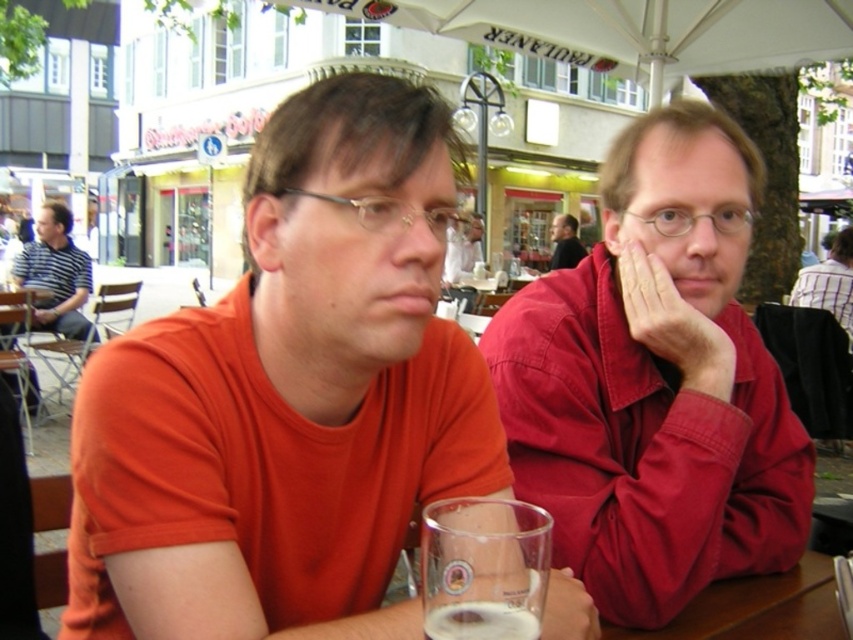
You are standing at the point with coordinates point [445,605] and want to walk towards the point with coordinates point [643,182]. Will you be moving forward or backward relative to your current position?

Since point [643,182] is behind point [445,605], moving towards it would mean you are moving backward relative to your current position at point [445,605].

You are a photographer trying to capture a closeup of the matte red shirt at right and the foamy glass at lower center. Which object should you zoom in on first to ensure it fits entirely within your camera frame?

The matte red shirt at right is wider than the foamy glass at lower center, so you should zoom in on the matte red shirt at right first to ensure it fits entirely within your camera frame.